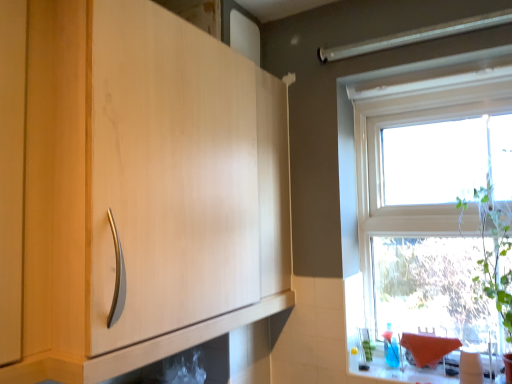
Question: Is matte wood cabinet at center to the left of white glossy counter top at lower right from the viewer's perspective?

Choices:
 (A) no
 (B) yes

Answer: (B)

Question: Does matte wood cabinet at center have a smaller size compared to white glossy counter top at lower right?

Choices:
 (A) no
 (B) yes

Answer: (A)

Question: Could white glossy counter top at lower right be considered to be inside matte wood cabinet at center?

Choices:
 (A) yes
 (B) no

Answer: (B)

Question: Is matte wood cabinet at center next to white glossy counter top at lower right?

Choices:
 (A) no
 (B) yes

Answer: (A)

Question: Is matte wood cabinet at center to the right of white glossy counter top at lower right from the viewer's perspective?

Choices:
 (A) no
 (B) yes

Answer: (A)

Question: From the image's perspective, is transparent glass window at upper right positioned above or below white glossy counter top at lower right?

Choices:
 (A) below
 (B) above

Answer: (B)

Question: Considering their positions, is transparent glass window at upper right located in front of or behind white glossy counter top at lower right?

Choices:
 (A) front
 (B) behind

Answer: (B)

Question: In terms of size, does transparent glass window at upper right appear bigger or smaller than white glossy counter top at lower right?

Choices:
 (A) small
 (B) big

Answer: (B)

Question: Would you say transparent glass window at upper right is inside or outside white glossy counter top at lower right?

Choices:
 (A) inside
 (B) outside

Answer: (B)

Question: From a real-world perspective, is white glossy counter top at lower right above or below transparent glass window at upper right?

Choices:
 (A) above
 (B) below

Answer: (B)

Question: Is white glossy counter top at lower right wider or thinner than transparent glass window at upper right?

Choices:
 (A) thin
 (B) wide

Answer: (B)

Question: Looking at the image, does white glossy counter top at lower right seem bigger or smaller compared to transparent glass window at upper right?

Choices:
 (A) small
 (B) big

Answer: (A)

Question: Considering the positions of point (426, 370) and point (501, 264), is point (426, 370) closer or farther from the camera than point (501, 264)?

Choices:
 (A) farther
 (B) closer

Answer: (A)

Question: From the image's perspective, is matte wood cabinet at center above or below transparent glass window at upper right?

Choices:
 (A) above
 (B) below

Answer: (A)

Question: Is matte wood cabinet at center situated inside transparent glass window at upper right or outside?

Choices:
 (A) inside
 (B) outside

Answer: (B)